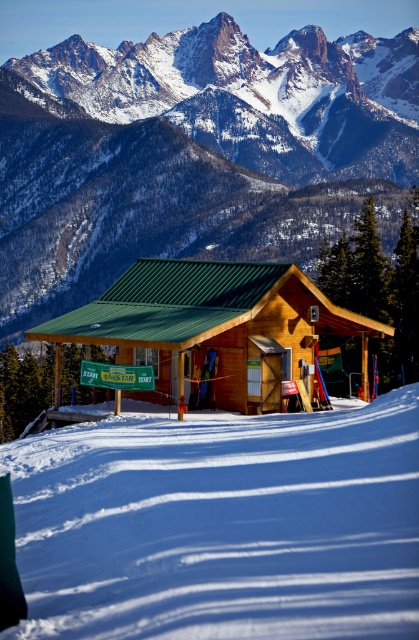
Does snowy rock at upper center appear on the left side of white snow at center?

Correct, you'll find snowy rock at upper center to the left of white snow at center.

Between snowy rock at upper center and white snow at center, which one is positioned lower?

white snow at center is lower down.

Is point (186, 109) behind point (382, 564)?

Yes, point (186, 109) is behind point (382, 564).

This screenshot has width=419, height=640. Identify the location of snowy rock at upper center. (191, 152).

Who is more distant from viewer, (264, 230) or (273, 282)?

Positioned behind is point (264, 230).

Is snowy rock at upper center taller than wooden cabin at center?

Yes.

Which is in front, point (12, 211) or point (150, 269)?

Point (150, 269)

Identify the location of snowy rock at upper center. (191, 152).

Between white snow at center and wooden cabin at center, which one appears on the left side from the viewer's perspective?

white snow at center

What do you see at coordinates (220, 525) in the screenshot?
I see `white snow at center` at bounding box center [220, 525].

The width and height of the screenshot is (419, 640). Identify the location of white snow at center. (220, 525).